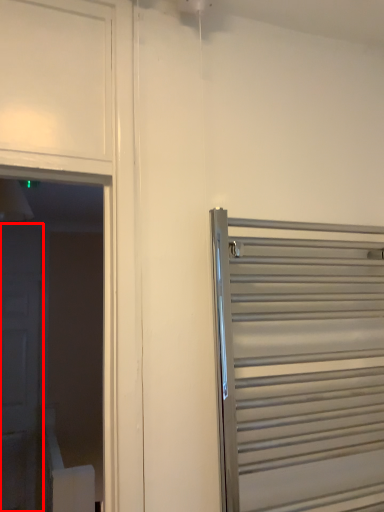
Question: From the image's perspective, considering the relative positions of door (annotated by the red box) and door in the image provided, where is door (annotated by the red box) located with respect to the staircase?

Choices:
 (A) above
 (B) below

Answer: (B)